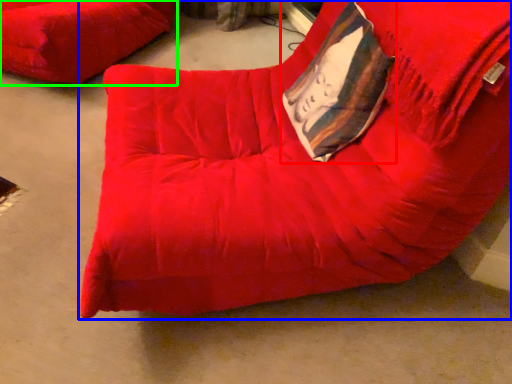
Question: Considering the real-world distances, which object is closest to throw pillow (highlighted by a red box)? furniture (highlighted by a blue box) or furniture (highlighted by a green box).

Choices:
 (A) furniture
 (B) furniture

Answer: (A)